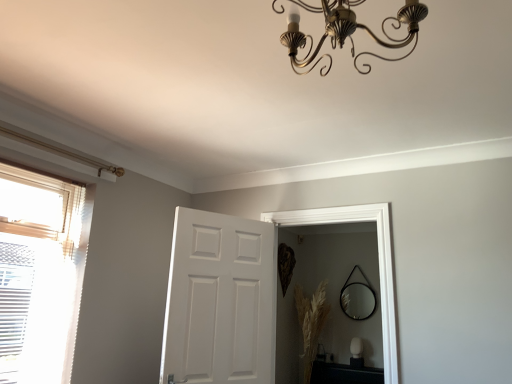
In order to face white matte door at center, should I rotate leftwards or rightwards?

To align with it, rotate left about 4.043°.

This screenshot has height=384, width=512. Describe the element at coordinates (345, 373) in the screenshot. I see `black glossy table at lower right` at that location.

The image size is (512, 384). What are the coordinates of `gold metallic chandelier at upper center` in the screenshot? It's located at (348, 31).

Considering the sizes of objects dry grass at lower right and black glass mirror at center in the image provided, who is wider, dry grass at lower right or black glass mirror at center?

Wider between the two is dry grass at lower right.

Based on their sizes in the image, would you say dry grass at lower right is bigger or smaller than black glass mirror at center?

dry grass at lower right is bigger than black glass mirror at center.

Considering the points (317, 326) and (348, 299), which point is in front, point (317, 326) or point (348, 299)?

The point (317, 326) is more forward.

From the image's perspective, which one is positioned higher, dry grass at lower right or black glass mirror at center?

black glass mirror at center.

Is black glass mirror at center looking in the opposite direction of black glossy table at lower right?

No.

Between black glass mirror at center and black glossy table at lower right, which one is positioned behind?

black glass mirror at center.

Does black glass mirror at center have a lesser width compared to black glossy table at lower right?

Yes, black glass mirror at center is thinner than black glossy table at lower right.

Would you consider black glass mirror at center to be distant from black glossy table at lower right?

No, black glass mirror at center is in close proximity to black glossy table at lower right.

At what (x,y) coordinates should I click in order to perform the action: click on plant below the translucent fabric window at left (from the image's perspective). Please return your answer as a coordinate pair (x, y). Looking at the image, I should click on (311, 322).

From a real-world perspective, is translucent fabric window at left under dry grass at lower right?

No, from a real-world perspective, translucent fabric window at left is not beneath dry grass at lower right.

Does translucent fabric window at left appear on the left side of dry grass at lower right?

Yes.

Can you confirm if translucent fabric window at left is wider than dry grass at lower right?

No.

Is the depth of gold metallic chandelier at upper center less than that of dry grass at lower right?

Yes, gold metallic chandelier at upper center is closer to the viewer.

Based on the photo, from a real-world perspective, does gold metallic chandelier at upper center sit lower than dry grass at lower right?

Actually, gold metallic chandelier at upper center is physically above dry grass at lower right in the real world.

Is gold metallic chandelier at upper center at the right side of dry grass at lower right?

No.

How far apart are black glass mirror at center and dry grass at lower right?

They are 52.74 centimeters apart.

Is there a large distance between black glass mirror at center and dry grass at lower right?

No, black glass mirror at center is not far from dry grass at lower right.

Considering the positions of objects black glass mirror at center and dry grass at lower right in the image provided, who is more to the right, black glass mirror at center or dry grass at lower right?

black glass mirror at center is more to the right.

What's the angular difference between gold metallic chandelier at upper center and white matte door at center's facing directions?

gold metallic chandelier at upper center and white matte door at center are facing 116 degrees away from each other.

Between gold metallic chandelier at upper center and white matte door at center, which one is positioned in front?

gold metallic chandelier at upper center is more forward.

Measure the distance between gold metallic chandelier at upper center and white matte door at center.

5.79 feet.

Is gold metallic chandelier at upper center far from white matte door at center?

That's right, there is a large distance between gold metallic chandelier at upper center and white matte door at center.

Is black glossy table at lower right directly adjacent to gold metallic chandelier at upper center?

They are not placed beside each other.

In the scene shown: Is black glossy table at lower right completely or partially outside of gold metallic chandelier at upper center?

Yes, black glossy table at lower right is located beyond the bounds of gold metallic chandelier at upper center.

The width and height of the screenshot is (512, 384). What are the coordinates of `light fixture in front of the black glossy table at lower right` in the screenshot? It's located at (348, 31).

Is black glossy table at lower right at the left side of gold metallic chandelier at upper center?

No, black glossy table at lower right is not to the left of gold metallic chandelier at upper center.

Find the location of a particular element. This screenshot has width=512, height=384. mirror on the right of dry grass at lower right is located at coordinates (358, 301).

Identify the location of table in front of the black glass mirror at center. (345, 373).

Estimate the real-world distances between objects in this image. Which object is closer to white matte door at center, dry grass at lower right or translucent fabric window at left?

translucent fabric window at left lies closer to white matte door at center than the other object.

Looking at the image, which one is located closer to gold metallic chandelier at upper center, translucent fabric window at left or black glass mirror at center?

Based on the image, translucent fabric window at left appears to be nearer to gold metallic chandelier at upper center.

Considering their positions, is black glossy table at lower right positioned closer to white matte door at center than dry grass at lower right?

The object closer to white matte door at center is dry grass at lower right.

Based on their spatial positions, is black glossy table at lower right or black glass mirror at center closer to gold metallic chandelier at upper center?

Among the two, black glossy table at lower right is located nearer to gold metallic chandelier at upper center.

Estimate the real-world distances between objects in this image. Which object is further from gold metallic chandelier at upper center, black glossy table at lower right or translucent fabric window at left?

Based on the image, black glossy table at lower right appears to be further to gold metallic chandelier at upper center.

From the image, which object appears to be farther from gold metallic chandelier at upper center, black glossy table at lower right or dry grass at lower right?

black glossy table at lower right is positioned further to the anchor gold metallic chandelier at upper center.

When comparing their distances from white matte door at center, does black glass mirror at center or dry grass at lower right seem closer?

dry grass at lower right is positioned closer to the anchor white matte door at center.

Based on their spatial positions, is dry grass at lower right or black glossy table at lower right closer to gold metallic chandelier at upper center?

Among the two, dry grass at lower right is located nearer to gold metallic chandelier at upper center.

Where is `door positioned between translucent fabric window at left and dry grass at lower right from near to far`? door positioned between translucent fabric window at left and dry grass at lower right from near to far is located at coordinates (220, 300).

I want to click on door between translucent fabric window at left and black glossy table at lower right in the horizontal direction, so click(x=220, y=300).

I want to click on door between gold metallic chandelier at upper center and black glossy table at lower right in the front-back direction, so click(220, 300).

Identify the location of plant between black glass mirror at center and black glossy table at lower right from top to bottom. This screenshot has height=384, width=512. (311, 322).